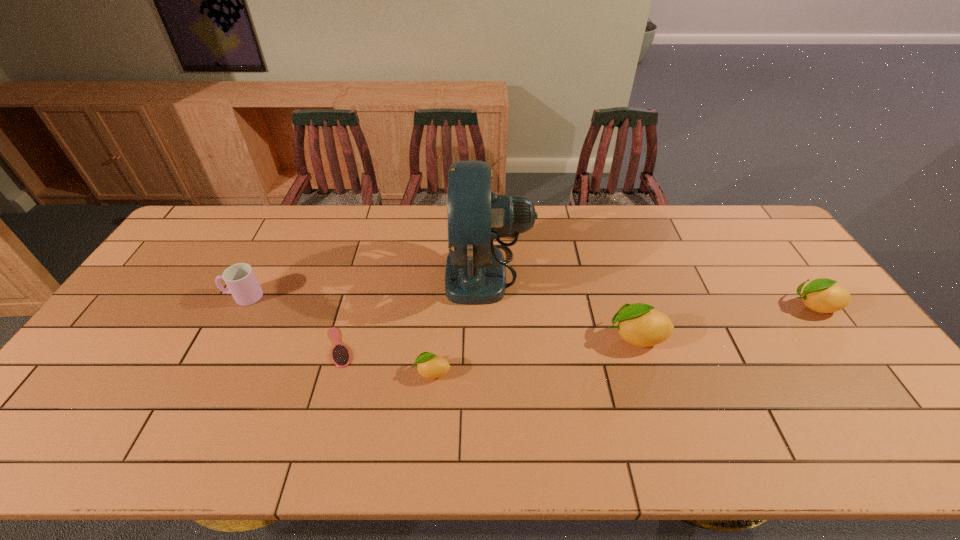
The image size is (960, 540). Find the location of `the shortest lemon`. the shortest lemon is located at coordinates (431, 366).

Identify the location of the nearest lemon. (431, 366).

This screenshot has width=960, height=540. I want to click on the second nearest lemon, so click(639, 324).

Locate an element on the screen. Image resolution: width=960 pixels, height=540 pixels. the second lemon from left to right is located at coordinates (639, 324).

Where is `the farthest lemon`? the farthest lemon is located at coordinates (822, 295).

Locate an element on the screen. Image resolution: width=960 pixels, height=540 pixels. the rightmost lemon is located at coordinates (822, 295).

What are the coordinates of `the leftmost object` in the screenshot? It's located at (x=240, y=279).

At what (x,y) coordinates should I click in order to perform the action: click on fan. Please return your answer as a coordinate pair (x, y). Looking at the image, I should click on (475, 274).

The image size is (960, 540). Find the location of `the second object from left to right`. the second object from left to right is located at coordinates (341, 357).

At what (x,y) coordinates should I click in order to perform the action: click on hairbrush. Please return your answer as a coordinate pair (x, y). This screenshot has width=960, height=540. Looking at the image, I should click on (341, 357).